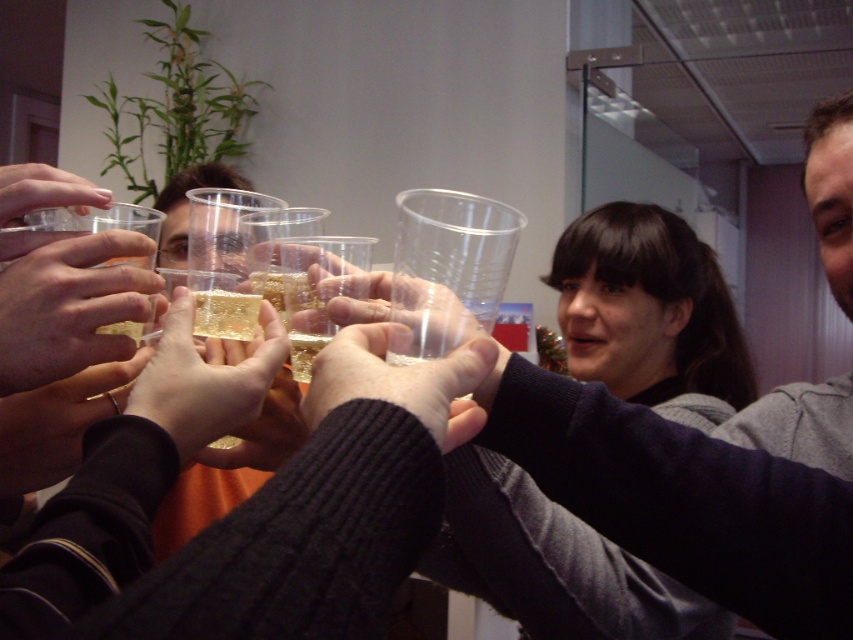
Question: Is black matte hand at lower left smaller than transparent plastic cup at upper left?

Choices:
 (A) no
 (B) yes

Answer: (B)

Question: Among these points, which one is farthest from the camera?

Choices:
 (A) [x=492, y=349]
 (B) [x=41, y=461]
 (C) [x=189, y=444]
 (D) [x=45, y=188]

Answer: (B)

Question: Which of the following is the closest to the observer?

Choices:
 (A) transparent plastic cup at center
 (B) translucent plastic cup at center
 (C) matte gold ring at center

Answer: (A)

Question: Can you confirm if transparent plastic cup at center is bigger than transparent plastic cup at upper left?

Choices:
 (A) yes
 (B) no

Answer: (B)

Question: Which object is positioned farthest from the transparent plastic cup at upper left?

Choices:
 (A) translucent plastic block at center
 (B) matte gold ring at center

Answer: (A)

Question: Can you confirm if translucent plastic block at center is thinner than translucent plastic cup at center?

Choices:
 (A) no
 (B) yes

Answer: (B)